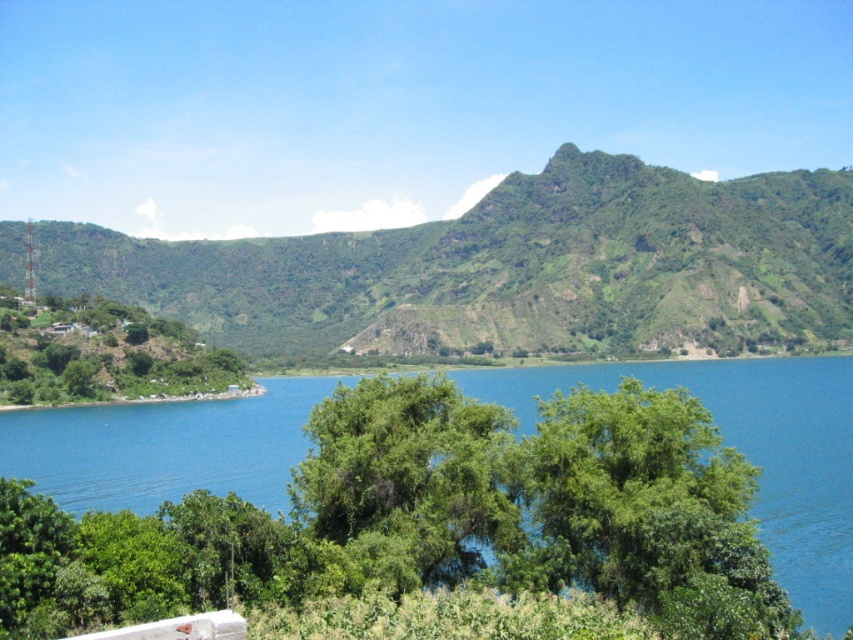
You are standing at the point marked as point (511, 268). What is the name of the object located at this point?

The green leafy mountain at center is located at point (511, 268).

You are a hiker standing at the edge of the lake and you see the green leafy tree at center and the green leafy tree at left. Which tree is shorter?

The green leafy tree at center is shorter than the green leafy tree at left.